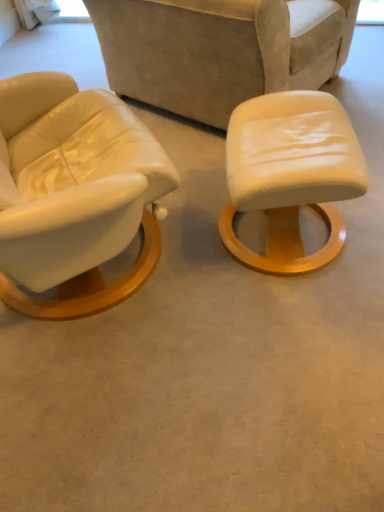
Find the location of a particular element. free location to the left of matte white stool at center is located at coordinates (181, 250).